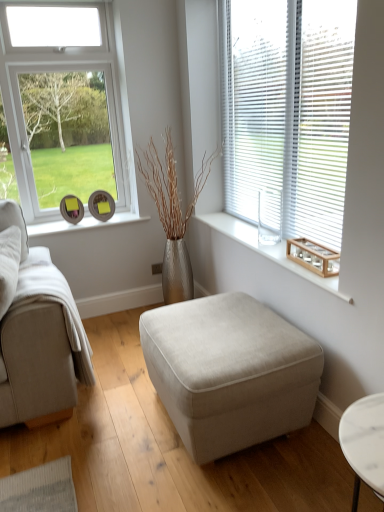
Identify the location of white plastic blinds at upper right. (287, 109).

Describe the element at coordinates (230, 372) in the screenshot. The height and width of the screenshot is (512, 384). I see `beige fabric ottoman at center` at that location.

At what (x,y) coordinates should I click in order to perform the action: click on wooden box at right. Please return your answer as a coordinate pair (x, y). Looking at the image, I should click on (313, 256).

Locate an element on the screen. Image resolution: width=384 pixels, height=512 pixels. white plastic blinds at upper right is located at coordinates (287, 109).

Between white plastic blinds at upper right and wooden tray at right, which one is positioned in front?

white plastic blinds at upper right is closer to the camera.

Is white plastic blinds at upper right facing towards wooden tray at right?

Yes, white plastic blinds at upper right is facing wooden tray at right.

Between white plastic blinds at upper right and wooden tray at right, which one has less height?

Standing shorter between the two is wooden tray at right.

Who is more distant, wooden box at right or wooden tray at right?

wooden box at right is behind.

Considering the sizes of objects wooden box at right and wooden tray at right in the image provided, who is wider, wooden box at right or wooden tray at right?

With larger width is wooden tray at right.

From the image's perspective, is wooden box at right located above wooden tray at right?

No, from the image's perspective, wooden box at right is not over wooden tray at right.

Is wooden box at right turned away from wooden tray at right?

No, wooden box at right's orientation is not away from wooden tray at right.

Is white plastic blinds at upper right at the back of wooden box at right?

Yes, wooden box at right is positioned with its back facing white plastic blinds at upper right.

In the image, is wooden box at right positioned in front of or behind white plastic blinds at upper right?

Clearly, wooden box at right is behind white plastic blinds at upper right.

From a real-world perspective, is wooden box at right over white plastic blinds at upper right?

No, from a real-world perspective, wooden box at right is not above white plastic blinds at upper right.

How far apart are wooden box at right and white plastic blinds at upper right?

23.35 inches.

Looking at their sizes, would you say beige fabric ottoman at center is wider or thinner than wooden box at right?

Clearly, beige fabric ottoman at center has more width compared to wooden box at right.

Between beige fabric ottoman at center and wooden box at right, which one has less height?

wooden box at right is shorter.

Image resolution: width=384 pixels, height=512 pixels. In order to click on wood that is above the beige fabric ottoman at center (from a real-world perspective) in this screenshot , I will do `click(313, 256)`.

Between beige fabric ottoman at center and wooden box at right, which one has larger size?

Bigger between the two is beige fabric ottoman at center.

Is wooden tray at right in front of white plastic blinds at upper right?

No, it is not.

How far apart are wooden tray at right and white plastic blinds at upper right?

wooden tray at right and white plastic blinds at upper right are 23.87 inches apart.

Is wooden tray at right wider or thinner than white plastic blinds at upper right?

In the image, wooden tray at right appears to be wider than white plastic blinds at upper right.

From the picture: Is wooden tray at right not within white plastic blinds at upper right?

Yes.

From the image's perspective, is white plastic blinds at upper right located beneath beige fabric ottoman at center?

No, from the image's perspective, white plastic blinds at upper right is not beneath beige fabric ottoman at center.

What's the angular difference between white plastic blinds at upper right and beige fabric ottoman at center's facing directions?

0.312 degrees separate the facing orientations of white plastic blinds at upper right and beige fabric ottoman at center.

In the scene shown: Between white plastic blinds at upper right and beige fabric ottoman at center, which one has more height?

white plastic blinds at upper right.

Does white plastic blinds at upper right come in front of wooden box at right?

Yes, the depth of white plastic blinds at upper right is less than that of wooden box at right.

Does white plastic blinds at upper right have a larger size compared to wooden box at right?

A: Correct, white plastic blinds at upper right is larger in size than wooden box at right.

The width and height of the screenshot is (384, 512). In order to click on wood that appears on the right of white plastic blinds at upper right in this screenshot , I will do `click(313, 256)`.

At what (x,y) coordinates should I click in order to perform the action: click on window sill directly beneath the white plastic blinds at upper right (from a real-world perspective). Please return your answer as a coordinate pair (x, y). The image size is (384, 512). Looking at the image, I should click on click(268, 250).

Locate an element on the screen. The image size is (384, 512). wood that is above the wooden tray at right (from a real-world perspective) is located at coordinates click(x=313, y=256).

Based on their spatial positions, is white plastic blinds at upper right or wooden tray at right closer to wooden box at right?

wooden tray at right lies closer to wooden box at right than the other object.

From the image, which object appears to be nearer to wooden box at right, wooden tray at right or beige fabric ottoman at center?

wooden tray at right.

When comparing their distances from white plastic blinds at upper right, does wooden tray at right or beige fabric ottoman at center seem closer?

wooden tray at right is positioned closer to the anchor white plastic blinds at upper right.

Based on their spatial positions, is wooden box at right or beige fabric ottoman at center closer to white plastic blinds at upper right?

wooden box at right lies closer to white plastic blinds at upper right than the other object.

Based on the photo, looking at the image, which one is located further to wooden tray at right, white plastic blinds at upper right or beige fabric ottoman at center?

white plastic blinds at upper right lies further to wooden tray at right than the other object.

Based on the photo, from the image, which object appears to be nearer to wooden box at right, beige fabric ottoman at center or white plastic blinds at upper right?

Among the two, beige fabric ottoman at center is located nearer to wooden box at right.

Based on their spatial positions, is wooden tray at right or wooden box at right further from white plastic blinds at upper right?

wooden tray at right lies further to white plastic blinds at upper right than the other object.

Considering their positions, is wooden tray at right positioned closer to wooden box at right than white plastic blinds at upper right?

Based on the image, wooden tray at right appears to be nearer to wooden box at right.

Where is `wood between wooden tray at right and beige fabric ottoman at center from top to bottom`? wood between wooden tray at right and beige fabric ottoman at center from top to bottom is located at coordinates (313, 256).

This screenshot has width=384, height=512. Identify the location of wood that lies between white plastic blinds at upper right and beige fabric ottoman at center from top to bottom. (313, 256).

The image size is (384, 512). I want to click on window sill between white plastic blinds at upper right and beige fabric ottoman at center vertically, so coord(268,250).

At what (x,y) coordinates should I click in order to perform the action: click on window sill between white plastic blinds at upper right and wooden box at right in the up-down direction. Please return your answer as a coordinate pair (x, y). The image size is (384, 512). Looking at the image, I should click on (268, 250).